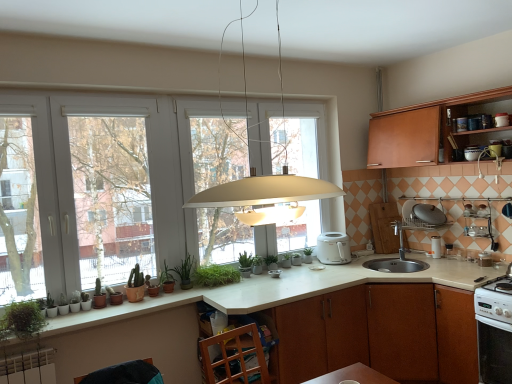
Question: From the image's perspective, is satin nickel sink at lower right positioned above or below metallic silver toaster at upper right, placed as the second appliance when sorted from front to back?

Choices:
 (A) below
 (B) above

Answer: (A)

Question: Based on their positions, is satin nickel sink at lower right located to the left or right of metallic silver toaster at upper right, which is the third appliance from bottom to top?

Choices:
 (A) right
 (B) left

Answer: (B)

Question: Which object is the farthest from the white plastic toaster at center, the 4th appliance positioned from the right?

Choices:
 (A) white glossy oven at lower right, which appears as the second kitchen appliance when viewed from the left
 (B) wooden cabinet at upper right, marked as the first cabinetry in a top-to-bottom arrangement
 (C) green matte plant at center, which ranks as the sixth plant in left-to-right order
 (D) green matte plant at lower left, which is counted as the sixth plant, starting from the right
 (E) matte white pendant light at center

Answer: (E)

Question: Estimate the real-world distances between objects in this image. Which object is closer to the green matte plant at center, the 3th plant positioned from the back?

Choices:
 (A) green matte plant at lower left, acting as the 5th plant starting from the front
 (B) wooden cabinet at upper right, marked as the first cabinetry in a top-to-bottom arrangement
 (C) white plastic toaster at upper right, which ranks as the 1th kitchen appliance in top-to-bottom order
 (D) matte white toaster at upper right, marked as the fourth appliance in a back-to-front arrangement
 (E) brown wood cabinet at lower center, which ranks as the second cabinetry in top-to-bottom order

Answer: (A)